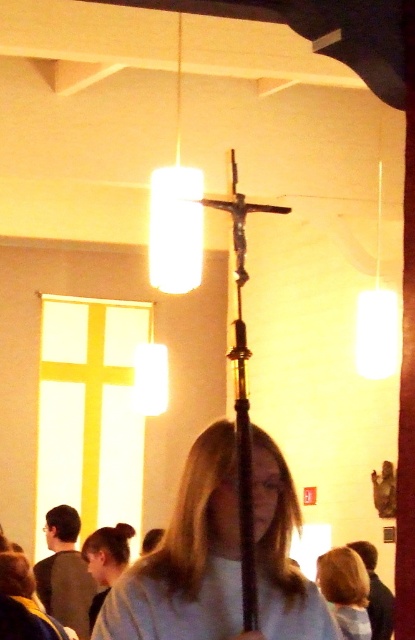
Question: Which object is positioned farthest from the light blue fabric at center?

Choices:
 (A) blonde hair at center
 (B) smooth gray sweater at center
 (C) blonde hair at lower left
 (D) white matte robe at lower left

Answer: (D)

Question: Is blonde hair at center positioned before blonde hair at lower left?

Choices:
 (A) yes
 (B) no

Answer: (A)

Question: Considering the real-world distances, which object is closest to the light blue fabric at center?

Choices:
 (A) blonde hair at center
 (B) blonde hair at lower left

Answer: (A)

Question: Is blonde hair at center thinner than blonde hair at lower left?

Choices:
 (A) no
 (B) yes

Answer: (A)

Question: Can you confirm if light blue fabric at center is wider than blonde hair at center?

Choices:
 (A) yes
 (B) no

Answer: (A)

Question: Which point is closer to the camera?

Choices:
 (A) (219, 525)
 (B) (44, 564)
 (C) (224, 582)
 (D) (341, 577)

Answer: (C)